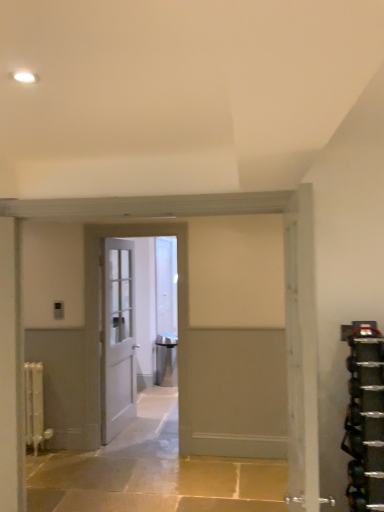
Question: Is white wooden door at center, which appears as the second door when viewed from the front, inside satin silver trash can at center?

Choices:
 (A) no
 (B) yes

Answer: (A)

Question: From a real-world perspective, is satin silver trash can at center located higher than white wooden door at center, which appears as the second door when viewed from the front?

Choices:
 (A) no
 (B) yes

Answer: (A)

Question: Is the position of satin silver trash can at center less distant than that of white wooden door at center, which ranks as the third door in right-to-left order?

Choices:
 (A) yes
 (B) no

Answer: (B)

Question: Does satin silver trash can at center turn towards white wooden door at center, which appears as the second door when viewed from the front?

Choices:
 (A) yes
 (B) no

Answer: (A)

Question: From a real-world perspective, is satin silver trash can at center beneath white wooden door at center, the third door when ordered from back to front?

Choices:
 (A) no
 (B) yes

Answer: (B)

Question: Is satin silver trash can at center positioned behind white wooden door at center, the third door when ordered from back to front?

Choices:
 (A) yes
 (B) no

Answer: (A)

Question: Would you say white matte radiator at left is part of white wooden door at center, the 2th door when ordered from back to front,'s contents?

Choices:
 (A) yes
 (B) no

Answer: (B)

Question: Does white wooden door at center, acting as the 3th door starting from the front, appear on the right side of white matte radiator at left?

Choices:
 (A) no
 (B) yes

Answer: (B)

Question: Considering the relative sizes of white wooden door at center, the first door in the left-to-right sequence, and white matte radiator at left in the image provided, is white wooden door at center, the first door in the left-to-right sequence, bigger than white matte radiator at left?

Choices:
 (A) no
 (B) yes

Answer: (B)

Question: Is white wooden door at center, the first door in the left-to-right sequence, far from white matte radiator at left?

Choices:
 (A) no
 (B) yes

Answer: (A)

Question: Considering the relative positions of white wooden door at center, acting as the 3th door starting from the front, and white matte radiator at left in the image provided, is white wooden door at center, acting as the 3th door starting from the front, to the left of white matte radiator at left from the viewer's perspective?

Choices:
 (A) yes
 (B) no

Answer: (B)

Question: Does white wooden door at center, the first door in the left-to-right sequence, turn towards white matte radiator at left?

Choices:
 (A) no
 (B) yes

Answer: (A)

Question: Considering the relative sizes of white matte radiator at left and white painted wood door at center, the first door viewed from the front, in the image provided, is white matte radiator at left taller than white painted wood door at center, the first door viewed from the front,?

Choices:
 (A) yes
 (B) no

Answer: (B)